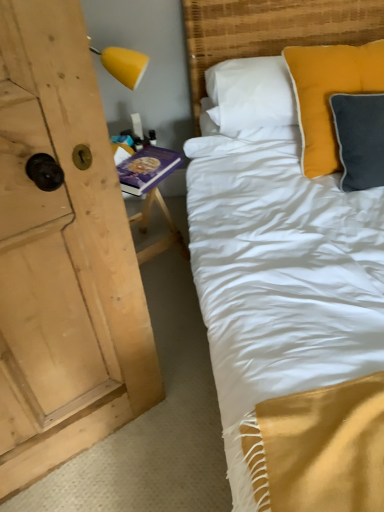
Question: Is matte yellow pillow at upper right next to woven bamboo headboard at upper right?

Choices:
 (A) yes
 (B) no

Answer: (B)

Question: Can you confirm if matte yellow pillow at upper right is positioned to the left of woven bamboo headboard at upper right?

Choices:
 (A) yes
 (B) no

Answer: (B)

Question: From a real-world perspective, is matte yellow pillow at upper right located beneath woven bamboo headboard at upper right?

Choices:
 (A) no
 (B) yes

Answer: (B)

Question: From the image's perspective, is matte yellow pillow at upper right under woven bamboo headboard at upper right?

Choices:
 (A) no
 (B) yes

Answer: (B)

Question: Does matte yellow pillow at upper right have a greater width compared to woven bamboo headboard at upper right?

Choices:
 (A) no
 (B) yes

Answer: (A)

Question: Can you confirm if matte yellow pillow at upper right is taller than woven bamboo headboard at upper right?

Choices:
 (A) yes
 (B) no

Answer: (B)

Question: Is purple hardcover book at left next to woven bamboo headboard at upper right?

Choices:
 (A) yes
 (B) no

Answer: (B)

Question: Does purple hardcover book at left have a greater height compared to woven bamboo headboard at upper right?

Choices:
 (A) no
 (B) yes

Answer: (A)

Question: Is purple hardcover book at left thinner than woven bamboo headboard at upper right?

Choices:
 (A) no
 (B) yes

Answer: (B)

Question: Does purple hardcover book at left lie in front of woven bamboo headboard at upper right?

Choices:
 (A) no
 (B) yes

Answer: (A)

Question: Considering the relative sizes of purple hardcover book at left and woven bamboo headboard at upper right in the image provided, is purple hardcover book at left wider than woven bamboo headboard at upper right?

Choices:
 (A) no
 (B) yes

Answer: (A)

Question: Considering the relative positions of purple hardcover book at left and woven bamboo headboard at upper right in the image provided, is purple hardcover book at left to the right of woven bamboo headboard at upper right from the viewer's perspective?

Choices:
 (A) no
 (B) yes

Answer: (A)

Question: Is matte yellow pillow at upper right completely or partially inside purple hardcover book at left?

Choices:
 (A) yes
 (B) no

Answer: (B)